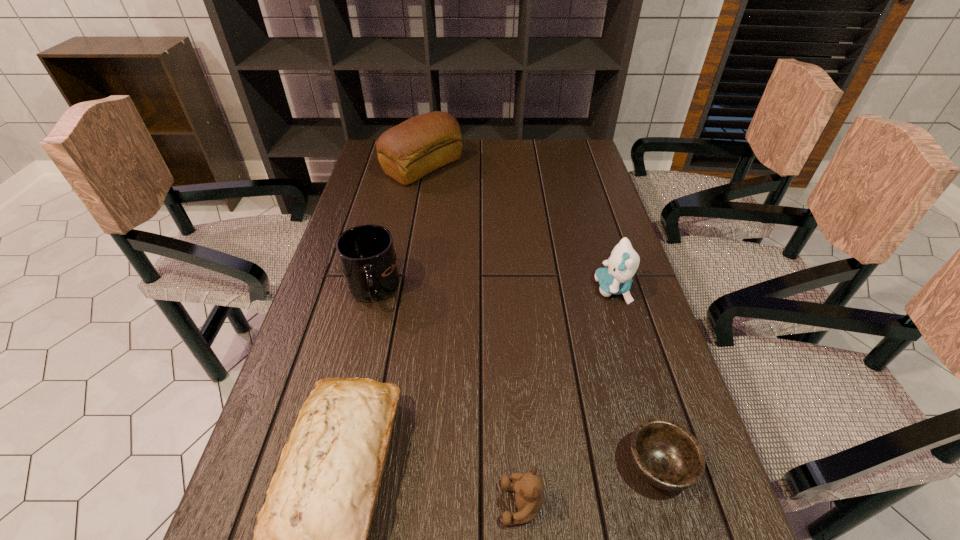
Locate an element on the screen. empty space that is in between the kitten and the tallest object is located at coordinates (518, 228).

Find the location of a particular element. The height and width of the screenshot is (540, 960). vacant area that lies between the shortest object and the fifth tallest object is located at coordinates (590, 484).

This screenshot has width=960, height=540. In order to click on free space between the kitten and the shortest object in this screenshot , I will do click(x=636, y=377).

Find the location of a particular element. This screenshot has width=960, height=540. vacant area that lies between the bowl and the third object from right to left is located at coordinates (590, 484).

Where is `free space between the farther bread and the second shortest object`? free space between the farther bread and the second shortest object is located at coordinates (473, 335).

Image resolution: width=960 pixels, height=540 pixels. In order to click on the fifth closest object relative to the third shortest object in this screenshot , I will do `click(407, 152)`.

At what (x,y) coordinates should I click in order to perform the action: click on object that can be found as the third closest to the mug. Please return your answer as a coordinate pair (x, y). Looking at the image, I should click on (529, 487).

Locate an element on the screen. The image size is (960, 540). free space that satisfies the following two spatial constraints: 1. on the front side of the farther bread; 2. on the right side of the shortest object is located at coordinates (370, 465).